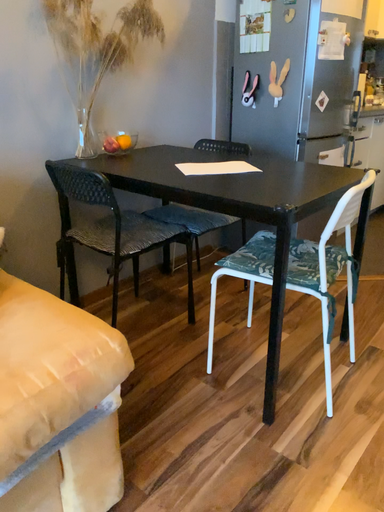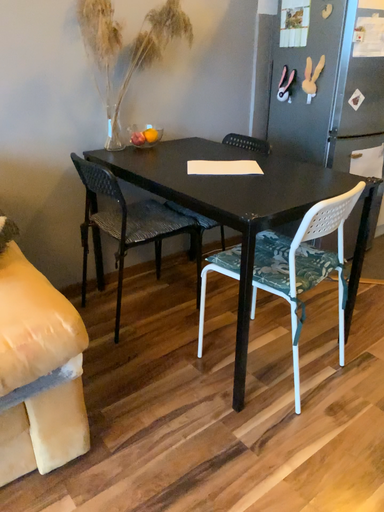
Question: Which way did the camera rotate in the video?

Choices:
 (A) rotated right
 (B) rotated left

Answer: (B)